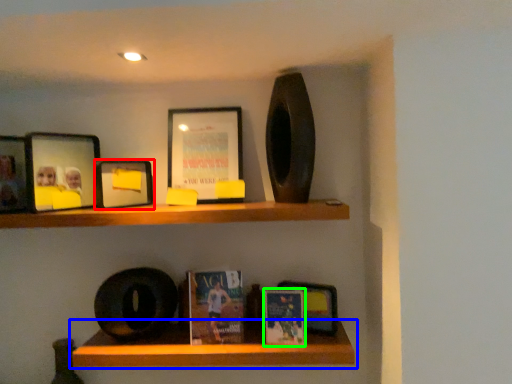
Question: Which is farther away from picture frame (highlighted by a red box)? shelf (highlighted by a blue box) or paperback book (highlighted by a green box)?

Choices:
 (A) shelf
 (B) paperback book

Answer: (B)